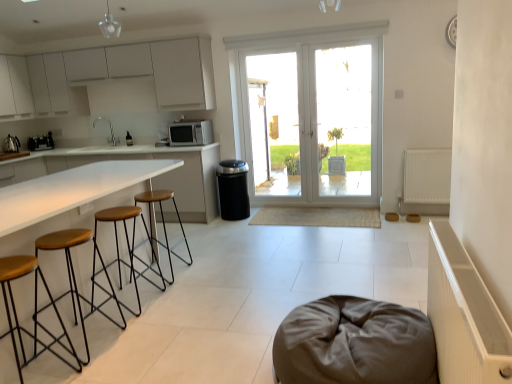
Where is `vacant space situated on the left part of brown fabric bean bag at lower right`? The width and height of the screenshot is (512, 384). vacant space situated on the left part of brown fabric bean bag at lower right is located at coordinates [212, 344].